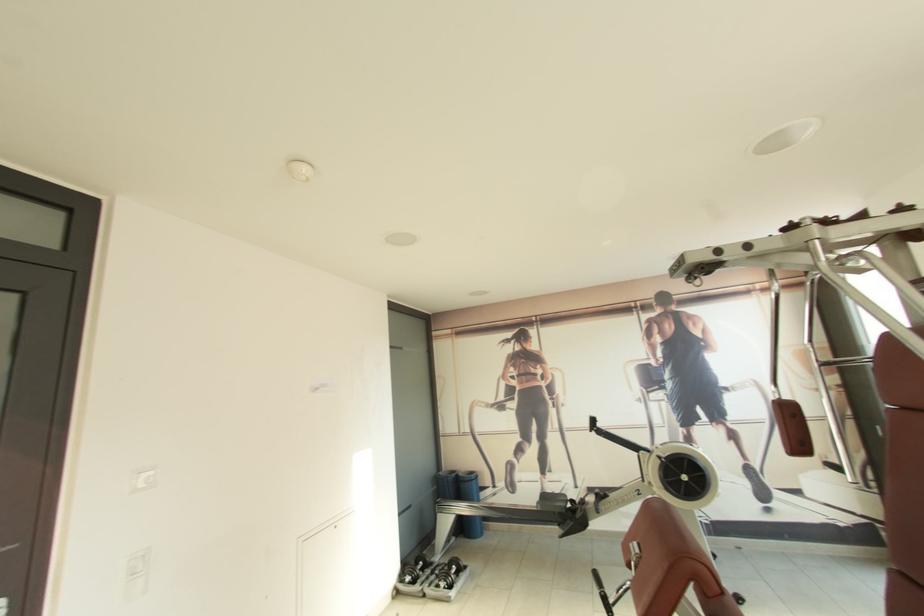
You are a GUI agent. You are given a task and a screenshot of the screen. Output one action in this format:
    pyautogui.click(x=<x>, y=<y>)
    Task: Click on the brown machine seat
    
    Given the screenshot: What is the action you would take?
    click(665, 557)